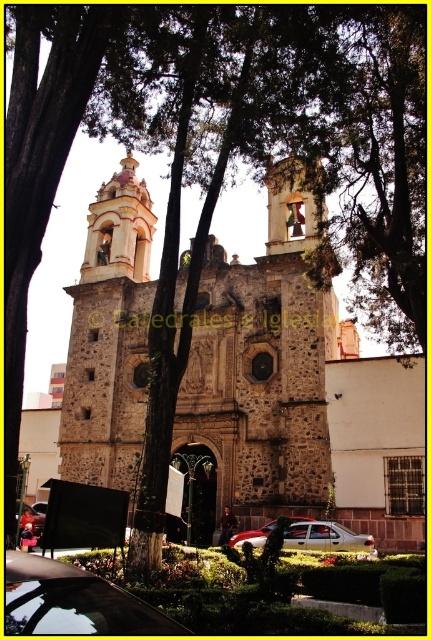
You are standing on the street in front of the stone textured church at center. You want to take a photo of the church with your smartphone. Your phone has a maximum zoom range of 5x. Considering the distance between you and the church, will you be able to capture the entire facade of the church in a single photo without moving closer?

The stone textured church at center is 189.32 feet away from the viewer. Since the maximum zoom range of your smartphone is 5x, and the distance is quite significant, it is unlikely that you can capture the entire facade of the stone textured church at center in a single photo without moving closer.

You are a parking attendant who needs to fit a new car that is 4 meters long into the space between the red metallic car at center and the metallic silver car at lower left. Can you determine if there is enough space based on their lengths?

The red metallic car at center is shorter than the metallic silver car at lower left. Since the new car is 4 meters long, but the exact lengths of the existing cars are not provided, it is impossible to determine if there is enough space without knowing their specific dimensions.

You are standing at the entrance of the historic stone church and want to walk to the metallic silver car at lower left. There is a red metallic car at center blocking your path. Can you walk around it? Please explain your reasoning.

The red metallic car at center is 27.19 meters away from the metallic silver car at lower left. Since the distance between them is quite large, you can easily walk around the red metallic car at center to reach the metallic silver car at lower left.